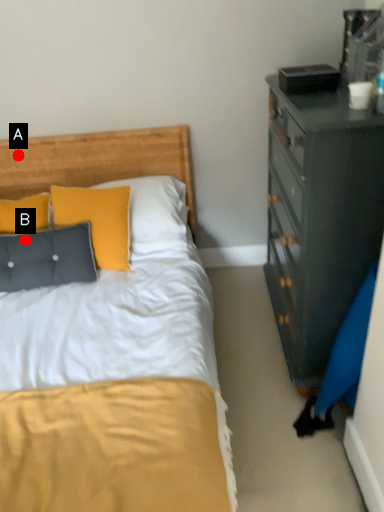
Question: Two points are circled on the image, labeled by A and B beside each circle. Which point is closer to the camera?

Choices:
 (A) A is closer
 (B) B is closer

Answer: (B)